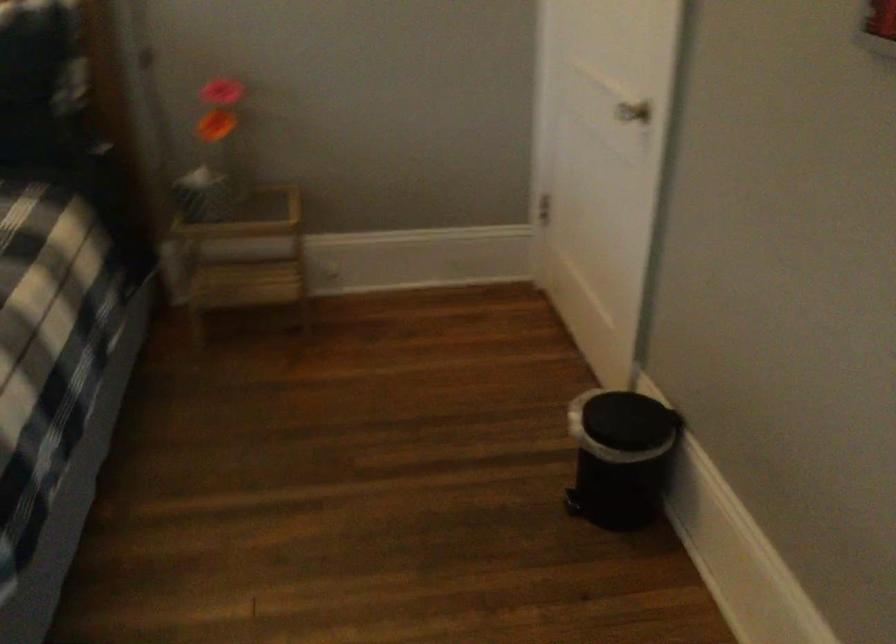
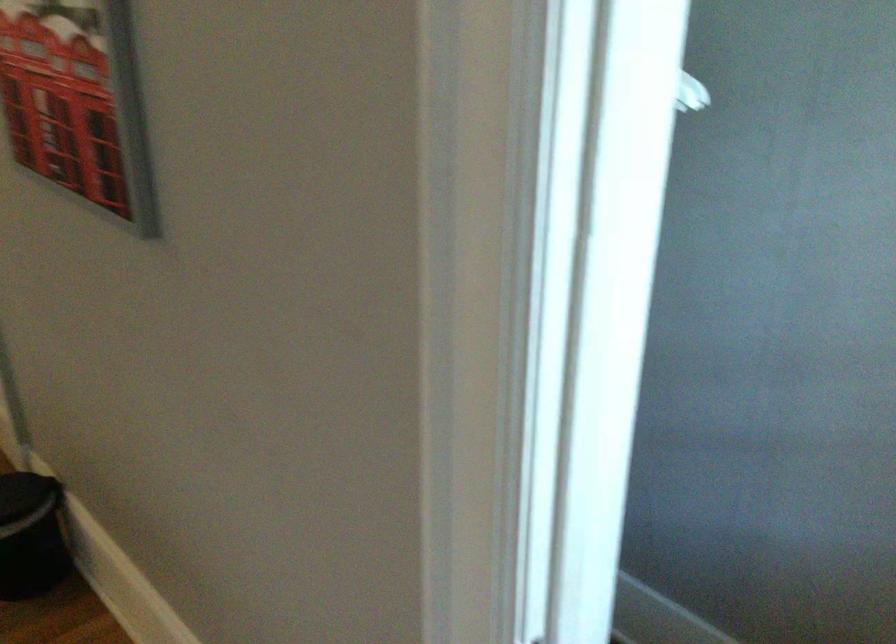
Question: The first image is from the beginning of the video and the second image is from the end. How did the camera likely rotate when shooting the video?

Choices:
 (A) Left
 (B) Right
 (C) Up
 (D) Down

Answer: (B)